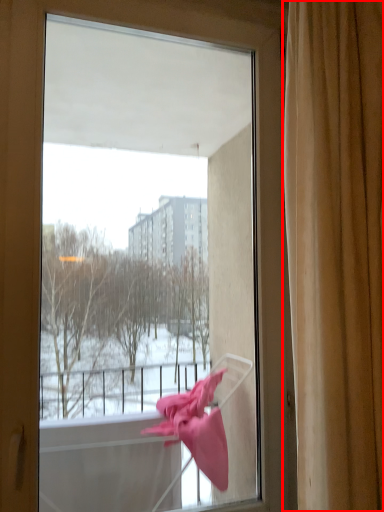
Question: Where is curtain (annotated by the red box) located in relation to window in the image?

Choices:
 (A) right
 (B) left

Answer: (A)